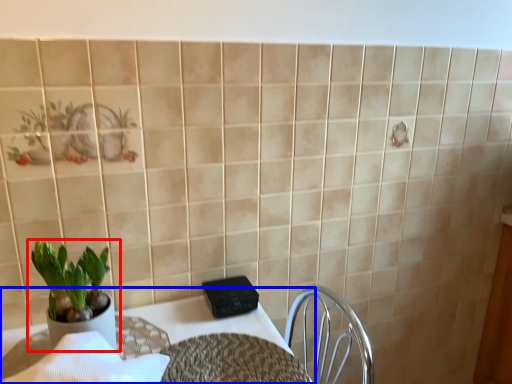
Question: Which object is further to the camera taking this photo, houseplant (highlighted by a red box) or table (highlighted by a blue box)?

Choices:
 (A) houseplant
 (B) table

Answer: (A)